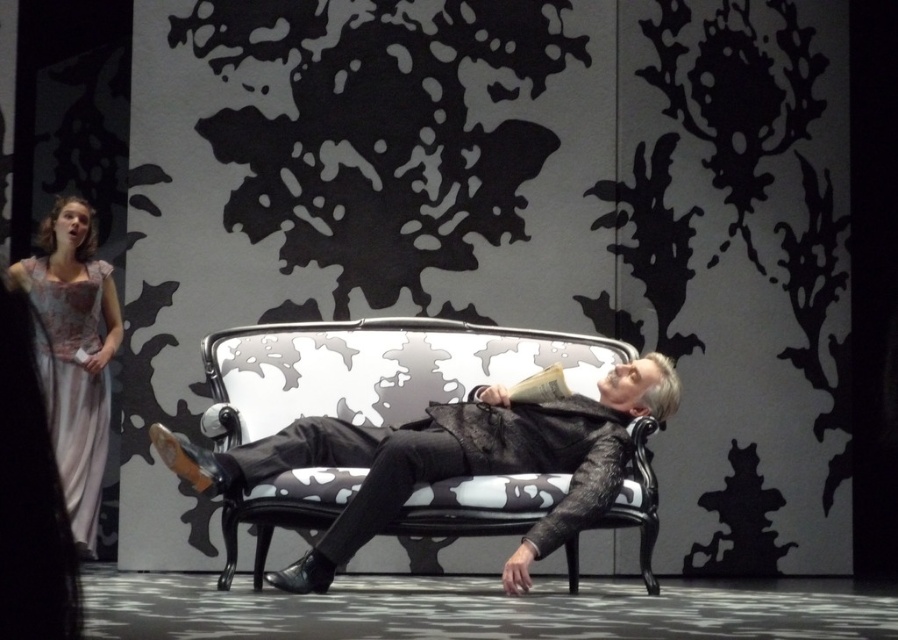
In the scene shown: Between black leather couch at center and silky satin gown at left, which one has more height?

Standing taller between the two is silky satin gown at left.

Is point (323, 500) behind point (82, 424)?

No, it is in front of (82, 424).

Find the location of a particular element. black leather couch at center is located at coordinates (376, 369).